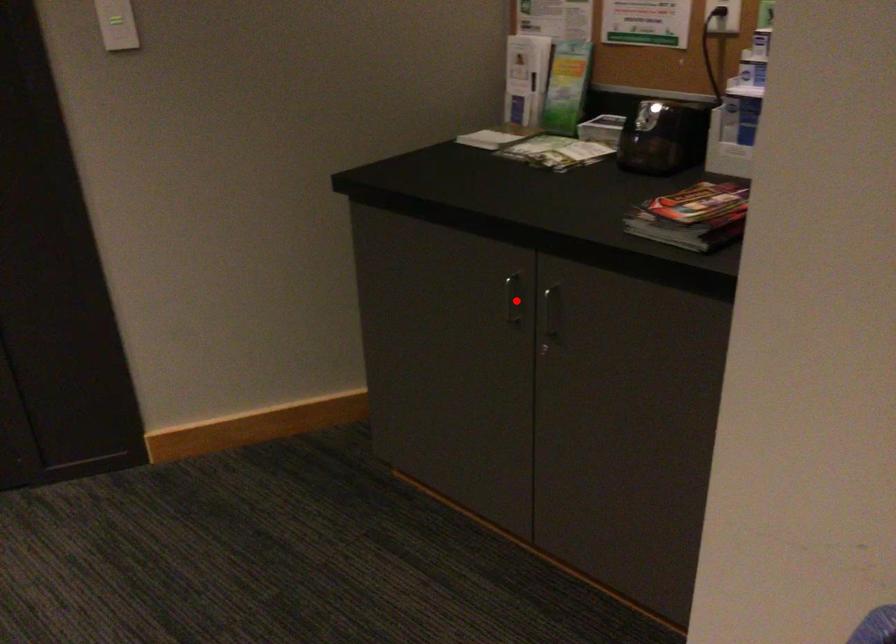
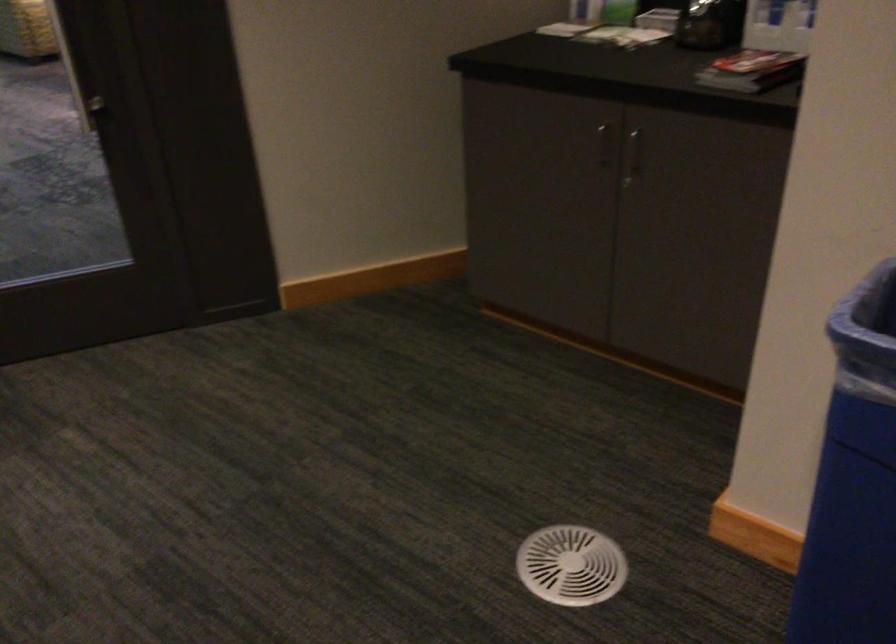
Where in the second image is the point corresponding to the highlighted location from the first image?

(604, 144)